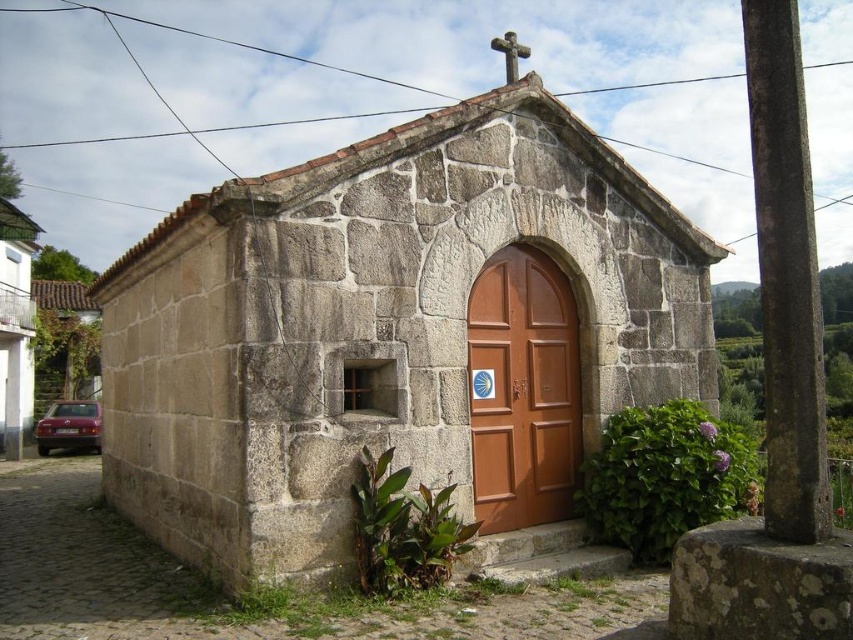
Question: Is the position of smooth concrete pillar at right more distant than that of white stone church at left?

Choices:
 (A) yes
 (B) no

Answer: (B)

Question: Is smooth concrete pillar at right wider than brown wooden door at center?

Choices:
 (A) yes
 (B) no

Answer: (A)

Question: Which of the following is the farthest from the observer?

Choices:
 (A) brown wooden door at center
 (B) smooth concrete pillar at right

Answer: (A)

Question: Which object is farther from the camera taking this photo?

Choices:
 (A) brown wooden door at center
 (B) stone church at center

Answer: (A)

Question: Among these objects, which one is nearest to the camera?

Choices:
 (A) smooth concrete pillar at right
 (B) white stone church at left
 (C) brown wooden door at center

Answer: (A)

Question: Considering the relative positions of stone church at center and brown wooden door at center in the image provided, where is stone church at center located with respect to brown wooden door at center?

Choices:
 (A) below
 (B) above

Answer: (B)